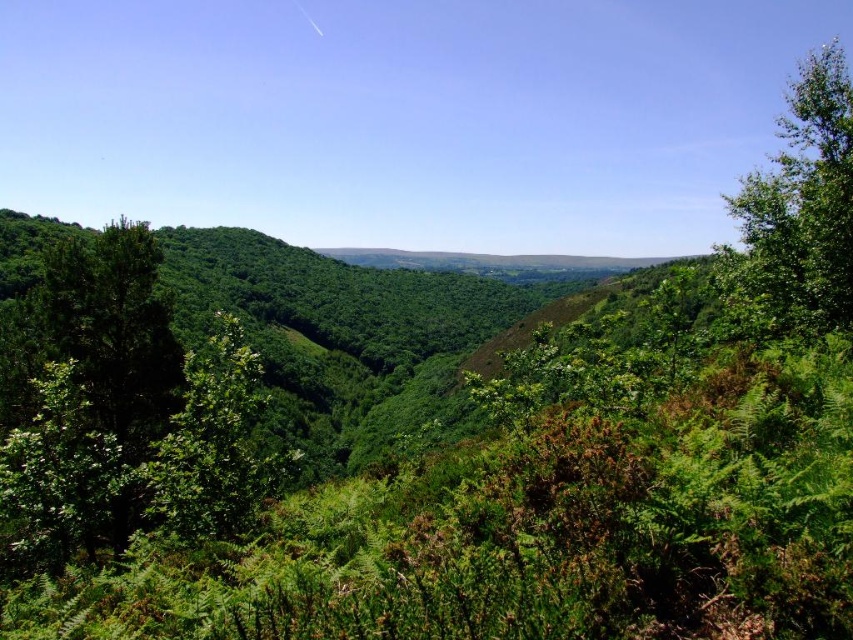
Question: Does green leafy tree at right have a smaller size compared to green leafy tree at center?

Choices:
 (A) no
 (B) yes

Answer: (A)

Question: Which point is closer to the camera?

Choices:
 (A) (196, 356)
 (B) (776, 310)

Answer: (B)

Question: Can you confirm if green leafy tree at right is bigger than green leafy tree at center?

Choices:
 (A) yes
 (B) no

Answer: (A)

Question: Can you confirm if green leafy tree at right is smaller than green leafy tree at center?

Choices:
 (A) yes
 (B) no

Answer: (B)